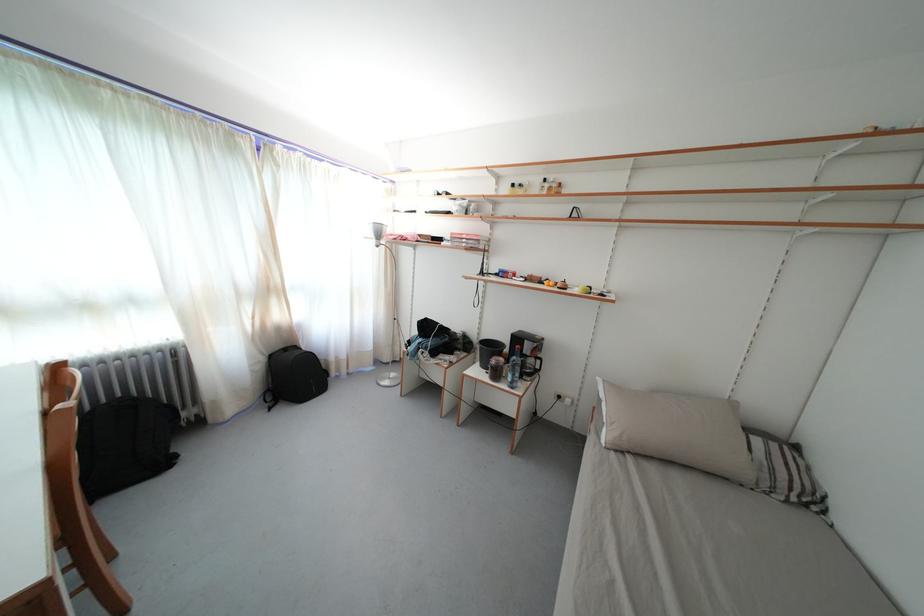
This screenshot has height=616, width=924. What do you see at coordinates (385, 305) in the screenshot? I see `the floor lamp head` at bounding box center [385, 305].